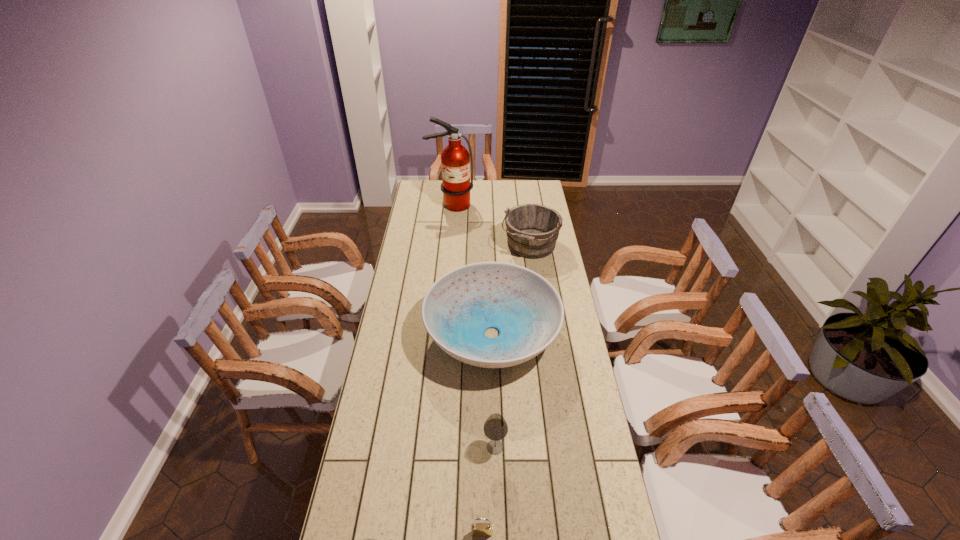
Where is `vacant space situated 0.090m on the left of the wineglass`? The width and height of the screenshot is (960, 540). vacant space situated 0.090m on the left of the wineglass is located at coordinates (455, 447).

Identify the location of object present at the far edge. The image size is (960, 540). (455, 160).

The image size is (960, 540). I want to click on object present at the left edge, so point(455,160).

The height and width of the screenshot is (540, 960). I want to click on wine bucket that is at the right edge, so click(x=532, y=230).

Find the location of a particular element. dish located in the right edge section of the desktop is located at coordinates (x=524, y=307).

Find the location of a particular element. Image resolution: width=960 pixels, height=540 pixels. object that is at the far left corner is located at coordinates (455, 160).

This screenshot has height=540, width=960. In order to click on free space at the left edge of the desktop in this screenshot , I will do `click(411, 234)`.

Identify the location of vacant region at the right edge. This screenshot has width=960, height=540. tap(565, 318).

Where is `vacant area that lies between the fifth farthest object and the wine bucket`? The width and height of the screenshot is (960, 540). vacant area that lies between the fifth farthest object and the wine bucket is located at coordinates [x=506, y=390].

Identify the location of free space between the padlock and the wineglass. The width and height of the screenshot is (960, 540). (489, 490).